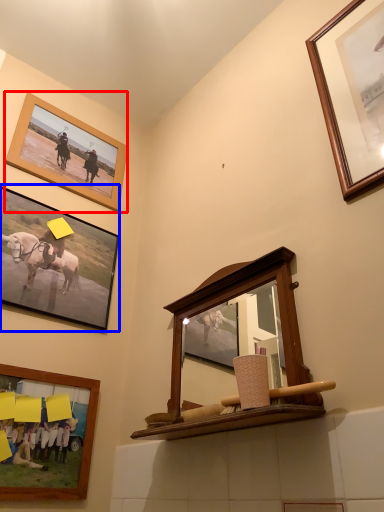
Question: Which of the following is the farthest to the observer, picture frame (highlighted by a red box) or picture frame (highlighted by a blue box)?

Choices:
 (A) picture frame
 (B) picture frame

Answer: (A)